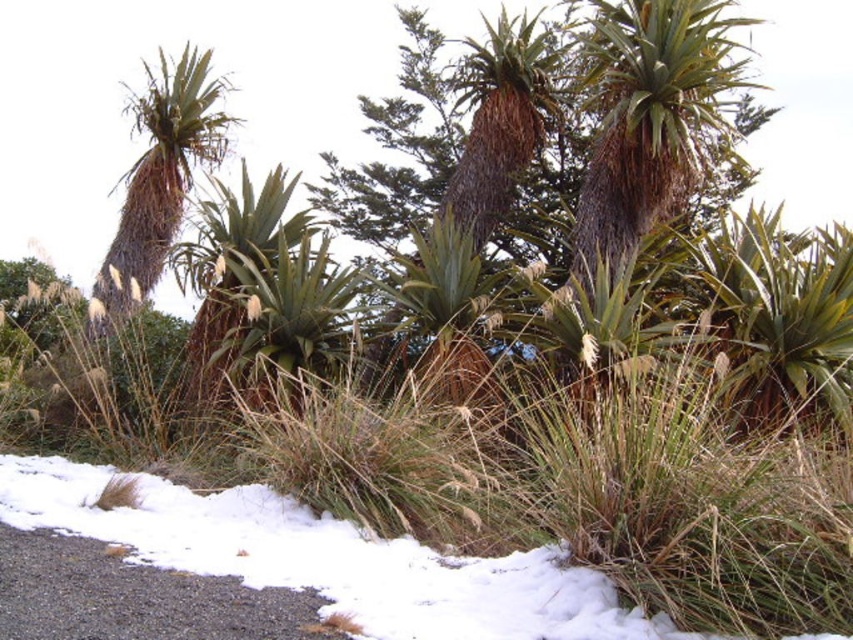
Is point (587, 1) positioned behind point (218, 301)?

Yes.

Who is lower down, brown textured palm tree at upper center or green fibrous palm tree at center?

Positioned lower is green fibrous palm tree at center.

The width and height of the screenshot is (853, 640). Find the location of `brown textured palm tree at upper center`. brown textured palm tree at upper center is located at coordinates (650, 115).

Does brown fibrous palm tree at upper left have a lesser height compared to green leafy palm tree at center?

In fact, brown fibrous palm tree at upper left may be taller than green leafy palm tree at center.

Looking at this image, measure the distance from brown fibrous palm tree at upper left to green leafy palm tree at center.

A distance of 9.83 feet exists between brown fibrous palm tree at upper left and green leafy palm tree at center.

Is point (112, 298) positioned before point (273, 257)?

No, (112, 298) is behind (273, 257).

You are a GUI agent. You are given a task and a screenshot of the screen. Output one action in this format:
    pyautogui.click(x=<x>, y=<y>)
    Task: Click on the brown fibrous palm tree at upper left
    Image resolution: width=853 pixels, height=640 pixels.
    Given the screenshot: What is the action you would take?
    pyautogui.click(x=160, y=179)

Between brown fibrous palm tree at upper left and brown textured palm tree at center, which one is positioned higher?

brown textured palm tree at center is above.

Can you confirm if brown fibrous palm tree at upper left is thinner than brown textured palm tree at center?

Yes.

Image resolution: width=853 pixels, height=640 pixels. In order to click on brown fibrous palm tree at upper left in this screenshot , I will do `click(160, 179)`.

Image resolution: width=853 pixels, height=640 pixels. Find the location of `brown fibrous palm tree at upper left`. brown fibrous palm tree at upper left is located at coordinates pyautogui.click(x=160, y=179).